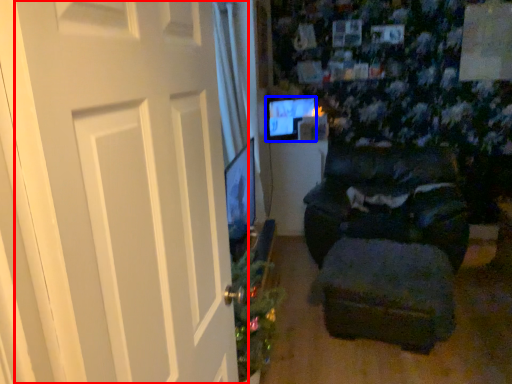
Question: Among these objects, which one is farthest to the camera, door (highlighted by a red box) or computer monitor (highlighted by a blue box)?

Choices:
 (A) door
 (B) computer monitor

Answer: (B)